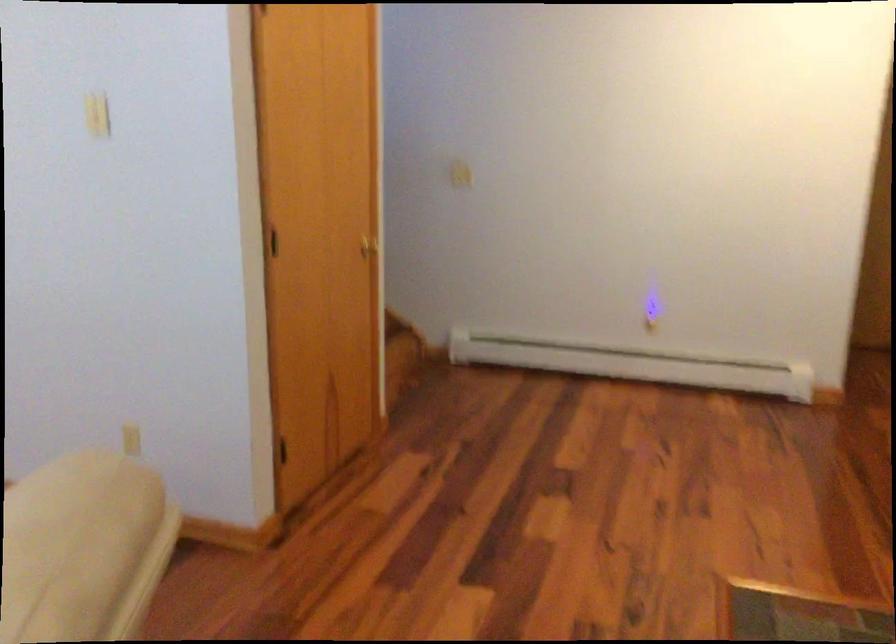
Identify the location of white light switch. This screenshot has height=644, width=896. [x=97, y=114].